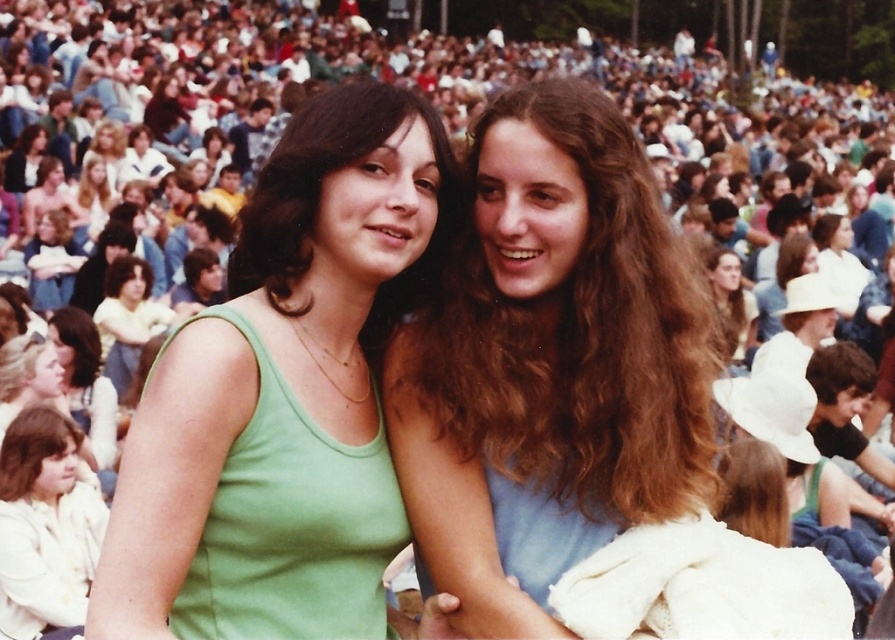
You are a photographer trying to capture a closeup of the green fabric tank top at center and the white matte jacket at lower left. Which object should you zoom in on to ensure both are in frame without moving the camera?

The green fabric tank top at center is wider than the white matte jacket at lower left, so you should zoom in on the green fabric tank top at center to ensure both are in frame without moving the camera.